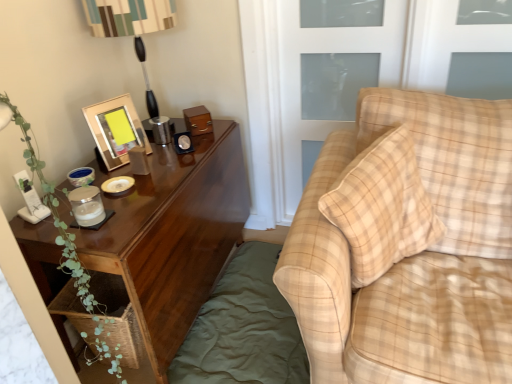
This screenshot has height=384, width=512. I want to click on free space in front of woodenobject at upper left, so click(x=134, y=170).